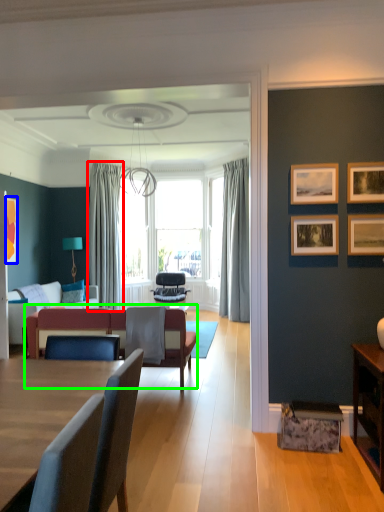
Question: Which object is the closest to the curtain (highlighted by a red box)? Choose among these: picture frame (highlighted by a blue box) or couch (highlighted by a green box).

Choices:
 (A) picture frame
 (B) couch

Answer: (A)